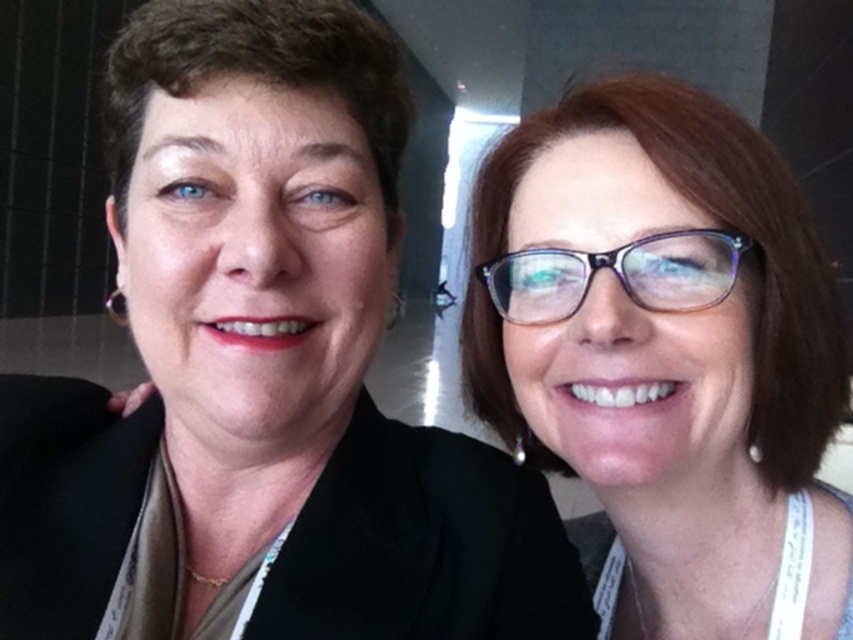
Which is behind, point (316, 241) or point (624, 262)?

Positioned behind is point (624, 262).

Between matte black jacket at left and transparent purple glasses at right, which one appears on the right side from the viewer's perspective?

Positioned to the right is transparent purple glasses at right.

Who is more distant from viewer, [22,628] or [550,280]?

The point [550,280] is more distant.

Image resolution: width=853 pixels, height=640 pixels. I want to click on matte black jacket at left, so click(262, 372).

Can you confirm if matte black glasses at upper right is positioned to the left of transparent purple glasses at right?

In fact, matte black glasses at upper right is to the right of transparent purple glasses at right.

Who is more forward, (701,237) or (640,259)?

Point (701,237) is more forward.

Who is more forward, (718, 262) or (590, 269)?

Point (590, 269) is in front.

The image size is (853, 640). In order to click on matte black glasses at upper right in this screenshot , I will do tap(666, 358).

Between matte black jacket at left and matte black glasses at upper right, which one appears on the left side from the viewer's perspective?

matte black jacket at left

Who is lower down, matte black jacket at left or matte black glasses at upper right?

matte black glasses at upper right is below.

You are a GUI agent. You are given a task and a screenshot of the screen. Output one action in this format:
    pyautogui.click(x=<x>, y=<y>)
    Task: Click on the matte black jacket at left
    Image resolution: width=853 pixels, height=640 pixels.
    Given the screenshot: What is the action you would take?
    pyautogui.click(x=262, y=372)

This screenshot has height=640, width=853. I want to click on matte black jacket at left, so click(x=262, y=372).